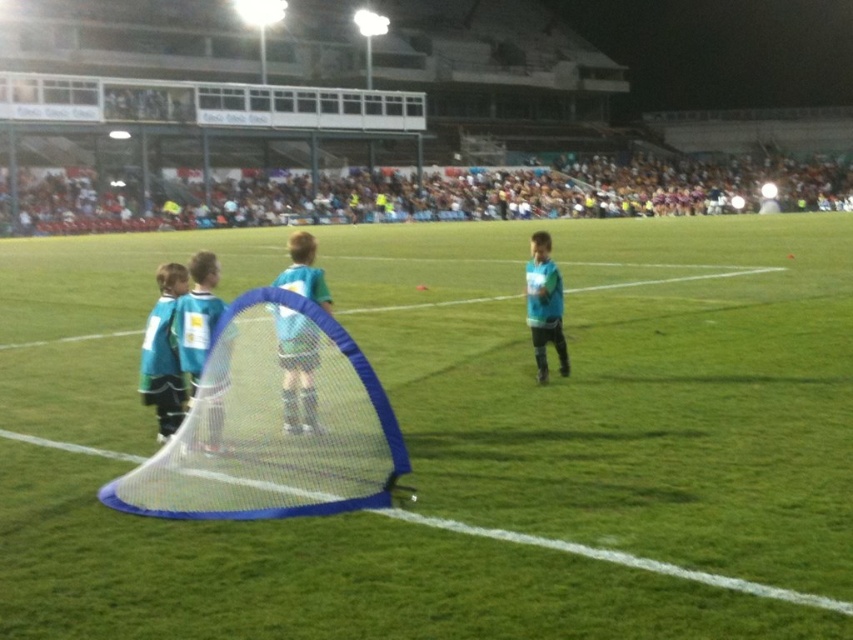
Question: Where is white mesh net at center located in relation to blue matte jersey at center in the image?

Choices:
 (A) left
 (B) right

Answer: (B)

Question: Among these objects, which one is nearest to the camera?

Choices:
 (A) blue matte jersey at center
 (B) light blue jersey at center

Answer: (A)

Question: Which point is farther to the camera?

Choices:
 (A) blue jersey at left
 (B) light blue jersey at center

Answer: (A)

Question: Can you confirm if white mesh net at center is smaller than blue matte jersey at center?

Choices:
 (A) no
 (B) yes

Answer: (A)

Question: Which object is positioned farthest from the blue net at center?

Choices:
 (A) white mesh net at center
 (B) light blue jersey at right
 (C) blue matte jersey at center
 (D) light blue jersey at center

Answer: (D)

Question: Is blue net at center above light blue jersey at center?

Choices:
 (A) yes
 (B) no

Answer: (A)